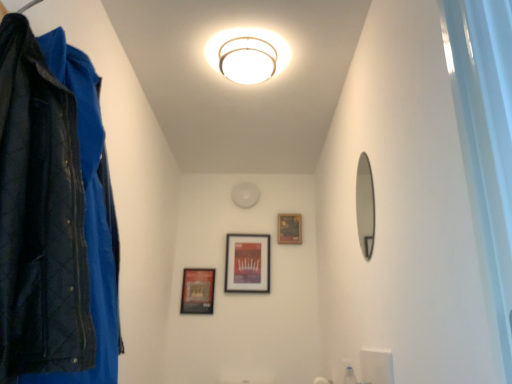
Question: Would you say smooth silver mirror at right is outside black matte picture frame at center, the 2th picture frame from the left?

Choices:
 (A) no
 (B) yes

Answer: (B)

Question: Is smooth silver mirror at right to the right of black matte picture frame at center, the 2th picture frame from the left, from the viewer's perspective?

Choices:
 (A) no
 (B) yes

Answer: (B)

Question: Is smooth silver mirror at right further to the viewer compared to black matte picture frame at center, the 2th picture frame from the left?

Choices:
 (A) no
 (B) yes

Answer: (A)

Question: Considering the relative sizes of smooth silver mirror at right and black matte picture frame at center, marked as the 2th picture frame in a right-to-left arrangement, in the image provided, is smooth silver mirror at right thinner than black matte picture frame at center, marked as the 2th picture frame in a right-to-left arrangement,?

Choices:
 (A) no
 (B) yes

Answer: (B)

Question: From a real-world perspective, is smooth silver mirror at right located beneath black matte picture frame at center, marked as the 2th picture frame in a right-to-left arrangement?

Choices:
 (A) no
 (B) yes

Answer: (B)

Question: Can you confirm if smooth silver mirror at right is smaller than black matte picture frame at center, marked as the 2th picture frame in a right-to-left arrangement?

Choices:
 (A) yes
 (B) no

Answer: (A)

Question: Is smooth silver mirror at right surrounding matte black picture frame at center, which ranks as the first picture frame in right-to-left order?

Choices:
 (A) yes
 (B) no

Answer: (B)

Question: Considering the relative sizes of smooth silver mirror at right and matte black picture frame at center, which ranks as the first picture frame in right-to-left order, in the image provided, is smooth silver mirror at right thinner than matte black picture frame at center, which ranks as the first picture frame in right-to-left order,?

Choices:
 (A) no
 (B) yes

Answer: (B)

Question: Is smooth silver mirror at right far from matte black picture frame at center, which is the third picture frame from left to right?

Choices:
 (A) yes
 (B) no

Answer: (A)

Question: From a real-world perspective, is smooth silver mirror at right positioned under matte black picture frame at center, which ranks as the first picture frame in right-to-left order, based on gravity?

Choices:
 (A) yes
 (B) no

Answer: (A)

Question: Would you say smooth silver mirror at right is outside matte black picture frame at center, which is the third picture frame from left to right?

Choices:
 (A) no
 (B) yes

Answer: (B)

Question: From a real-world perspective, is smooth silver mirror at right on top of matte black picture frame at center, which ranks as the first picture frame in right-to-left order?

Choices:
 (A) no
 (B) yes

Answer: (A)

Question: Is black matte picture frame at center, the 2th picture frame from the left, at the left side of matte black picture frame at center, which is the third picture frame from left to right?

Choices:
 (A) yes
 (B) no

Answer: (A)